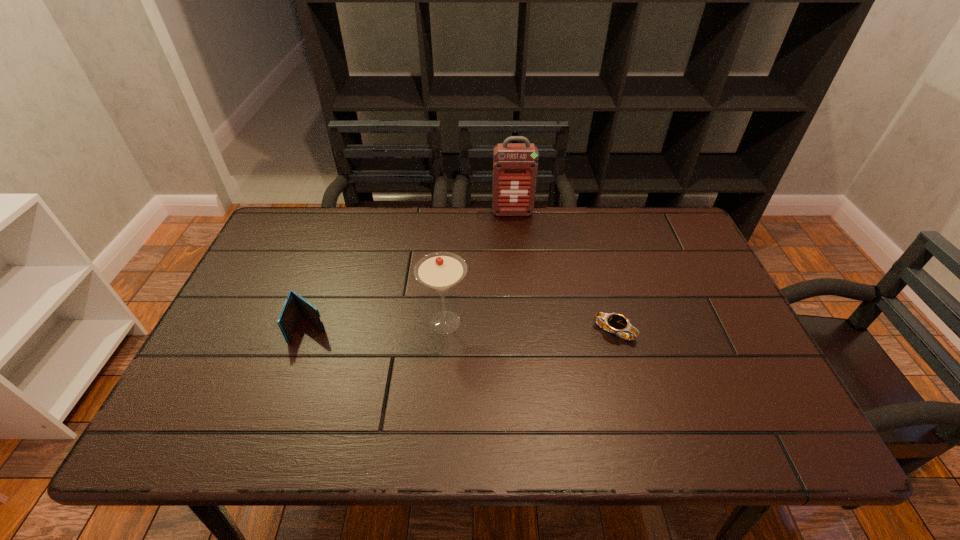
I want to click on vacant space located on the exterior surface of the wallet, so click(x=273, y=434).

The width and height of the screenshot is (960, 540). Find the location of `vacant region located 0.170m on the right of the rightmost object`. vacant region located 0.170m on the right of the rightmost object is located at coordinates (702, 332).

Locate an element on the screen. object located at the far edge is located at coordinates (515, 166).

Where is `blank space at the far edge of the desktop`? blank space at the far edge of the desktop is located at coordinates (481, 244).

This screenshot has height=540, width=960. I want to click on vacant region at the near edge, so click(292, 440).

Find the location of `vacant space at the left edge of the desktop`. vacant space at the left edge of the desktop is located at coordinates (304, 273).

At what (x,y) coordinates should I click in order to perform the action: click on vacant space at the right edge of the desktop. Please return your answer as a coordinate pair (x, y). The width and height of the screenshot is (960, 540). Looking at the image, I should click on (687, 275).

Locate an element on the screen. free location at the far left corner of the desktop is located at coordinates (288, 224).

Image resolution: width=960 pixels, height=540 pixels. I want to click on blank space at the far right corner of the desktop, so click(x=656, y=239).

Where is `free space between the rightmost object and the wallet`? free space between the rightmost object and the wallet is located at coordinates (463, 330).